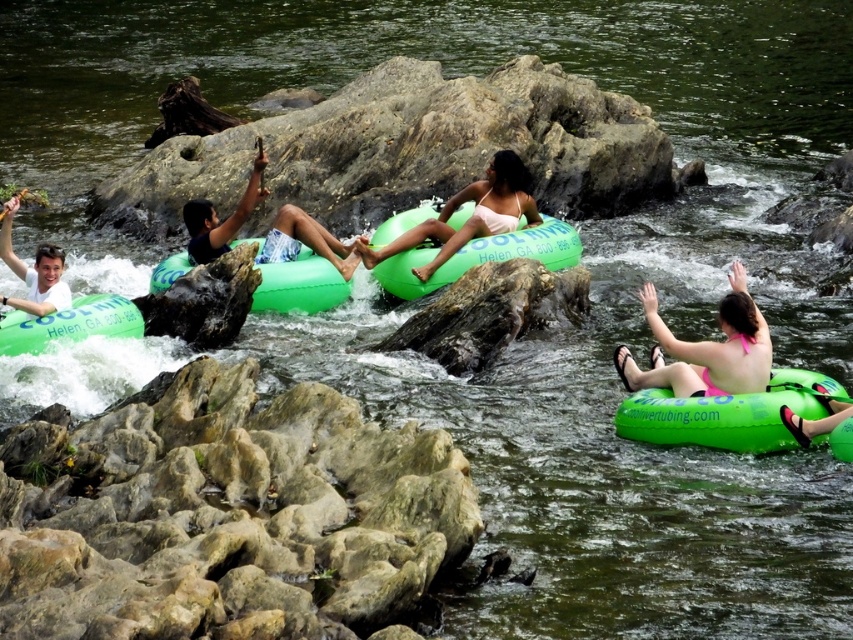
Does green inflatable raft at center appear under white matte shirt at upper left?

Correct, green inflatable raft at center is located below white matte shirt at upper left.

Between point (154, 275) and point (22, 280), which one is positioned behind?

Positioned behind is point (154, 275).

Image resolution: width=853 pixels, height=640 pixels. In order to click on green inflatable raft at center in this screenshot , I will do `click(299, 285)`.

Between pink fabric bikini at lower right and green rubber tube at center, which one is positioned lower?

pink fabric bikini at lower right

Can you confirm if pink fabric bikini at lower right is bigger than green rubber tube at center?

Incorrect, pink fabric bikini at lower right is not larger than green rubber tube at center.

Identify the location of pink fabric bikini at lower right. Image resolution: width=853 pixels, height=640 pixels. (x=704, y=349).

Consider the image. Does green rubber tube at center appear on the left side of green rubber tube at left?

No, green rubber tube at center is not to the left of green rubber tube at left.

Does point (332, 236) come in front of point (22, 333)?

That is False.

The image size is (853, 640). In order to click on green rubber tube at center in this screenshot , I will do `click(306, 241)`.